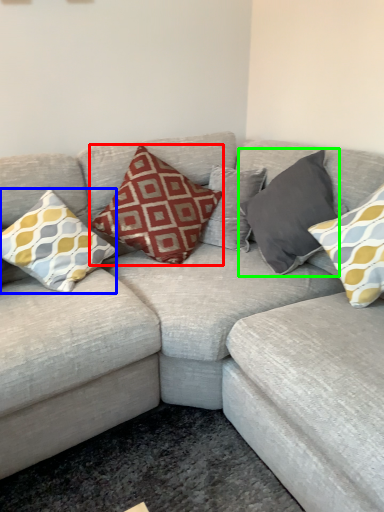
Question: Estimate the real-world distances between objects in this image. Which object is farther from pillow (highlighted by a red box), pillow (highlighted by a blue box) or pillow (highlighted by a green box)?

Choices:
 (A) pillow
 (B) pillow

Answer: (B)